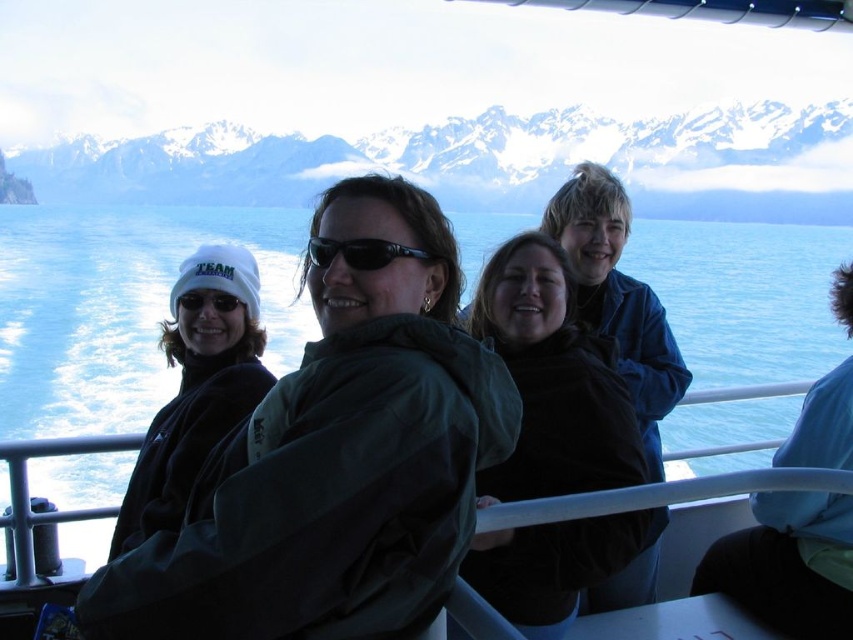
You are standing at the point labeled point (367,246) and want to walk towards the point labeled point (579,547). Is there any obstacle between you and your destination?

Point (579,547) is in front of point (367,246), so there is no obstacle between them.

In the image of the group on the boat, there are two people wearing headgear. One has a dark brown jacket at center and the other has a white fleece beanie at left. Which one is positioned more to the right?

The dark brown jacket at center is positioned to the right of the white fleece beanie at left, so the dark brown jacket at center is more to the right.